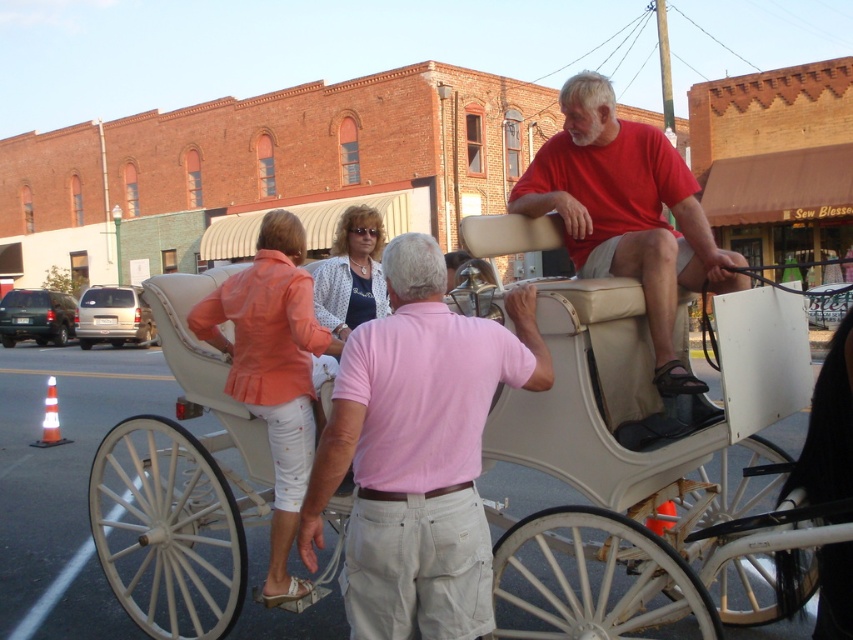
You are a tourist trying to take a photo of the white leather horse cart at center and the polka dot blouse at center. Which object should you focus on first if you want to capture both in one frame without zooming in or out?

You should focus on the white leather horse cart at center first because it is larger and will occupy more space in the frame, allowing the polka dot blouse at center to fit alongside without needing to adjust the zoom.

You are a passenger waiting to board the white leather horse cart at center and the orange fabric blouse at center. Which object is lower in position?

The white leather horse cart at center is located below orange fabric blouse at center, so the white leather horse cart at center is lower.

You are a tourist standing on the sidewalk and see the white leather horse cart at center and the orange fabric blouse at center. Which object is closer to the street?

The white leather horse cart at center is closer to the street because it is to the right of the orange fabric blouse at center, which would place it nearer to the road.